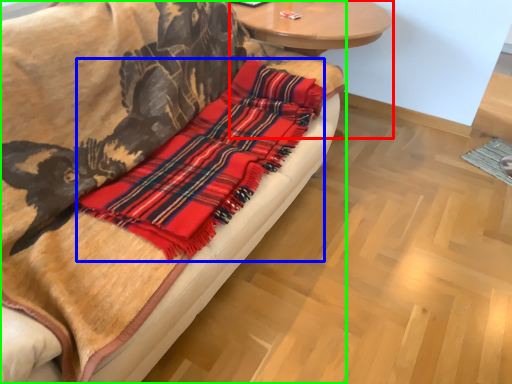
Question: Which object is positioned farthest from round table (highlighted by a red box)? Select from flannel (highlighted by a blue box) and studio couch (highlighted by a green box).

Choices:
 (A) flannel
 (B) studio couch

Answer: (B)